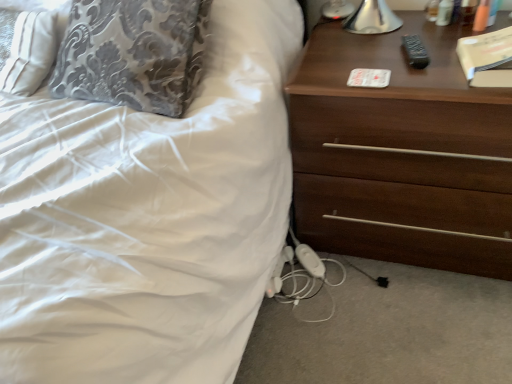
Measure the distance between beige matte book at upper right and camera.

beige matte book at upper right is 36.00 inches away from camera.

In order to click on beige matte book at upper right in this screenshot , I will do `click(484, 51)`.

The image size is (512, 384). What do you see at coordinates (484, 51) in the screenshot? I see `beige matte book at upper right` at bounding box center [484, 51].

The image size is (512, 384). What do you see at coordinates (401, 153) in the screenshot?
I see `dark brown wood chest of drawers at right` at bounding box center [401, 153].

Identify the location of dark brown wood chest of drawers at right. (401, 153).

Find the location of a particular element. Image resolution: width=512 pixels, height=384 pixels. beige matte book at upper right is located at coordinates (484, 51).

Looking at this image, considering the relative positions of dark brown wood chest of drawers at right and beige matte book at upper right in the image provided, is dark brown wood chest of drawers at right to the right of beige matte book at upper right from the viewer's perspective?

In fact, dark brown wood chest of drawers at right is to the left of beige matte book at upper right.

Which object is further away from the camera, dark brown wood chest of drawers at right or beige matte book at upper right?

Positioned behind is beige matte book at upper right.

Does point (345, 167) appear closer or farther from the camera than point (492, 40)?

Clearly, point (345, 167) is more distant from the camera than point (492, 40).

From the image's perspective, which one is positioned higher, dark brown wood chest of drawers at right or beige matte book at upper right?

beige matte book at upper right, from the image's perspective.

From a real-world perspective, is dark brown wood chest of drawers at right on beige matte book at upper right?

No.

Between dark brown wood chest of drawers at right and beige matte book at upper right, which one has smaller width?

Thinner between the two is beige matte book at upper right.

Can you confirm if dark brown wood chest of drawers at right is taller than beige matte book at upper right?

Indeed, dark brown wood chest of drawers at right has a greater height compared to beige matte book at upper right.

Does dark brown wood chest of drawers at right have a smaller size compared to beige matte book at upper right?

Actually, dark brown wood chest of drawers at right might be larger than beige matte book at upper right.

Is dark brown wood chest of drawers at right positioned beyond the bounds of beige matte book at upper right?

Absolutely, dark brown wood chest of drawers at right is external to beige matte book at upper right.

Consider the image. Would you say dark brown wood chest of drawers at right is a long distance from beige matte book at upper right?

dark brown wood chest of drawers at right is near beige matte book at upper right, not far away.

Is beige matte book at upper right at the back of dark brown wood chest of drawers at right?

dark brown wood chest of drawers at right is not turned away from beige matte book at upper right.

Find the location of `the chest of drawers located in front of the beige matte book at upper right`. the chest of drawers located in front of the beige matte book at upper right is located at coordinates (401, 153).

Visually, is beige matte book at upper right positioned to the left or to the right of dark brown wood chest of drawers at right?

From the image, it's evident that beige matte book at upper right is to the right of dark brown wood chest of drawers at right.

Considering their positions, is beige matte book at upper right located in front of or behind dark brown wood chest of drawers at right?

In the image, beige matte book at upper right appears behind dark brown wood chest of drawers at right.

Which is in front, point (483, 47) or point (351, 59)?

The point (483, 47) is closer to the camera.

From the image's perspective, between beige matte book at upper right and dark brown wood chest of drawers at right, which one is located above?

beige matte book at upper right appears higher in the image.

From a real-world perspective, which object stands above the other?

beige matte book at upper right, from a real-world perspective.

Can you confirm if beige matte book at upper right is thinner than dark brown wood chest of drawers at right?

Yes, beige matte book at upper right is thinner than dark brown wood chest of drawers at right.

Considering the sizes of beige matte book at upper right and dark brown wood chest of drawers at right in the image, is beige matte book at upper right taller or shorter than dark brown wood chest of drawers at right?

Considering their sizes, beige matte book at upper right has less height than dark brown wood chest of drawers at right.

Who is smaller, beige matte book at upper right or dark brown wood chest of drawers at right?

With smaller size is beige matte book at upper right.

Is beige matte book at upper right not within dark brown wood chest of drawers at right?

That's correct, beige matte book at upper right is outside of dark brown wood chest of drawers at right.

Is beige matte book at upper right placed right next to dark brown wood chest of drawers at right?

beige matte book at upper right and dark brown wood chest of drawers at right are not in contact.

Is dark brown wood chest of drawers at right at the back of beige matte book at upper right?

beige matte book at upper right does not have its back to dark brown wood chest of drawers at right.

From the picture: Can you tell me how much beige matte book at upper right and dark brown wood chest of drawers at right differ in facing direction?

The angle between the facing direction of beige matte book at upper right and the facing direction of dark brown wood chest of drawers at right is 6.27 degrees.

How distant is beige matte book at upper right from dark brown wood chest of drawers at right?

beige matte book at upper right and dark brown wood chest of drawers at right are 11.26 inches apart.

At what (x,y) coordinates should I click in order to perform the action: click on chest of drawers below the beige matte book at upper right (from the image's perspective). Please return your answer as a coordinate pair (x, y). This screenshot has width=512, height=384. Looking at the image, I should click on (401, 153).

Locate an element on the screen. The image size is (512, 384). book that is behind the dark brown wood chest of drawers at right is located at coordinates (484, 51).

Find the location of a particular element. The height and width of the screenshot is (384, 512). the chest of drawers lying below the beige matte book at upper right (from the image's perspective) is located at coordinates (401, 153).